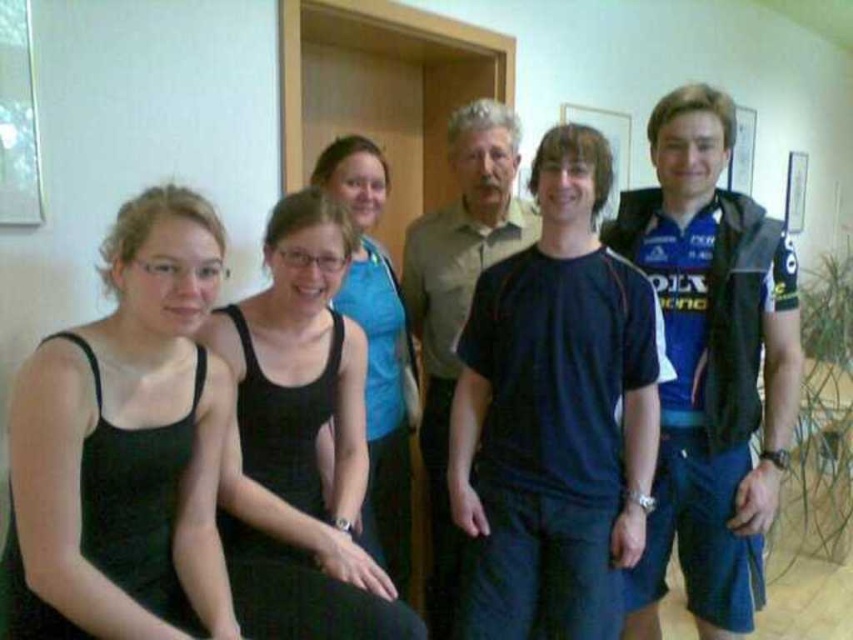
Question: Which object is closer to the camera taking this photo?

Choices:
 (A) dark blue fabric shirt at center
 (B) blue jersey at right

Answer: (A)

Question: From the image, what is the correct spatial relationship of black fabric tank top at center in relation to black matte tank top at center?

Choices:
 (A) right
 (B) left

Answer: (B)

Question: Considering the real-world distances, which object is farthest from the blue jersey at right?

Choices:
 (A) black matte tank top at center
 (B) black fabric tank top at center

Answer: (B)

Question: Does black fabric tank top at center appear on the left side of black matte tank top at center?

Choices:
 (A) no
 (B) yes

Answer: (B)

Question: Which point appears farthest from the camera in this image?

Choices:
 (A) (479, 332)
 (B) (231, 513)
 (C) (396, 285)
 (D) (96, 512)

Answer: (C)

Question: Considering the relative positions of blue jersey at right and black fabric tank top at center in the image provided, where is blue jersey at right located with respect to black fabric tank top at center?

Choices:
 (A) left
 (B) right

Answer: (B)